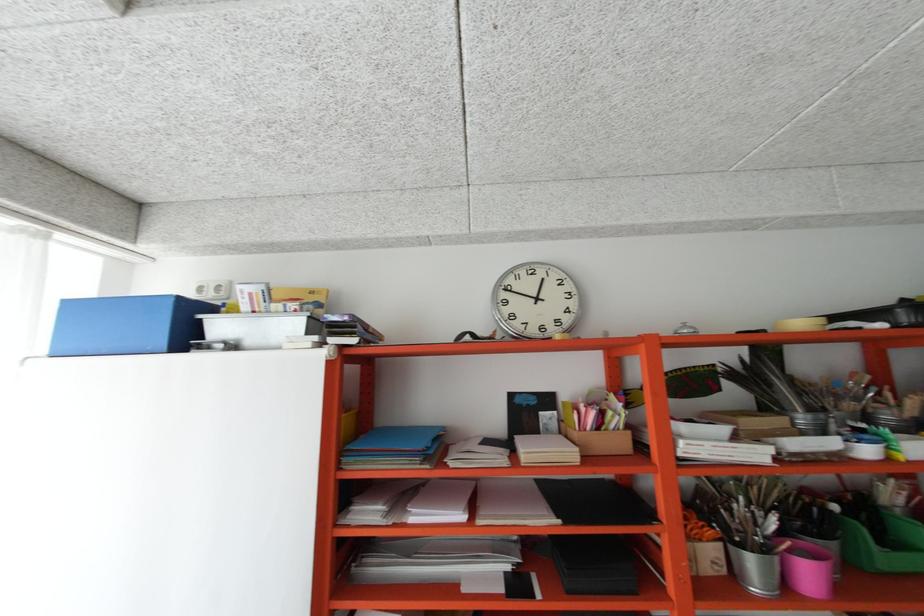
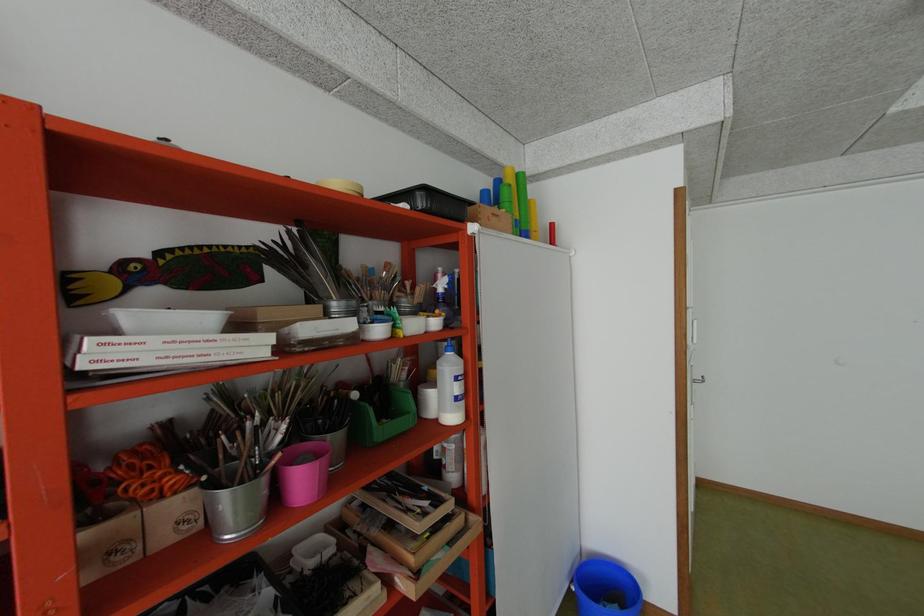
Question: The camera is either moving clockwise (left) or counter-clockwise (right) around the object. The first image is from the beginning of the video and the second image is from the end. Is the camera moving left or right when shooting the video?

Choices:
 (A) Left
 (B) Right

Answer: (A)